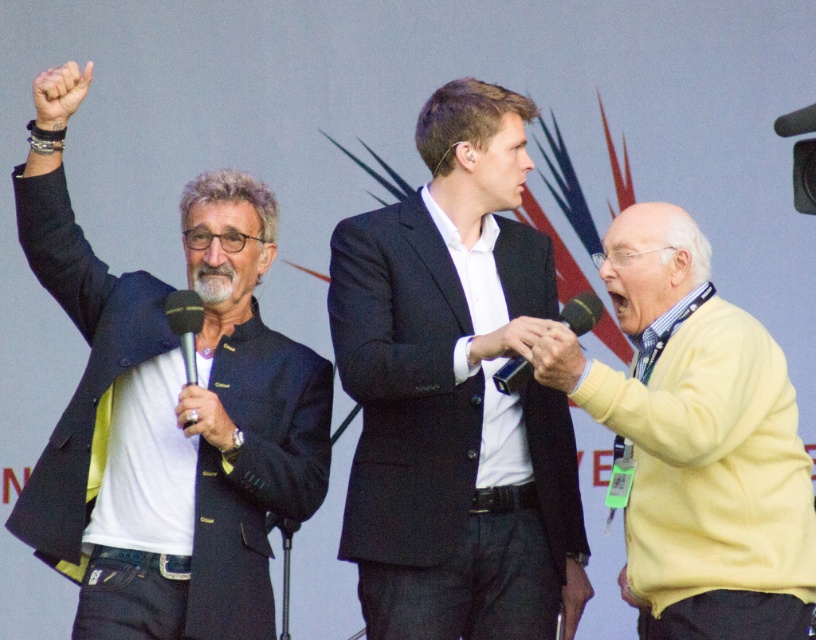
Question: Which point is farther to the camera?

Choices:
 (A) black suit jacket at center
 (B) black matte microphone at left
 (C) yellow sweater at right

Answer: (B)

Question: Which object is positioned closest to the yellow sweater at right?

Choices:
 (A) black suit jacket at center
 (B) black plastic microphone at center

Answer: (A)

Question: Is black suit jacket at center above black matte microphone at left?

Choices:
 (A) yes
 (B) no

Answer: (B)

Question: Which object is the closest to the black matte microphone at left?

Choices:
 (A) black suit jacket at center
 (B) matte black jacket at left
 (C) yellow sweater at right

Answer: (B)

Question: Is black suit jacket at center thinner than matte black jacket at left?

Choices:
 (A) no
 (B) yes

Answer: (B)

Question: Is yellow sweater at right to the left of black plastic microphone at center from the viewer's perspective?

Choices:
 (A) no
 (B) yes

Answer: (A)